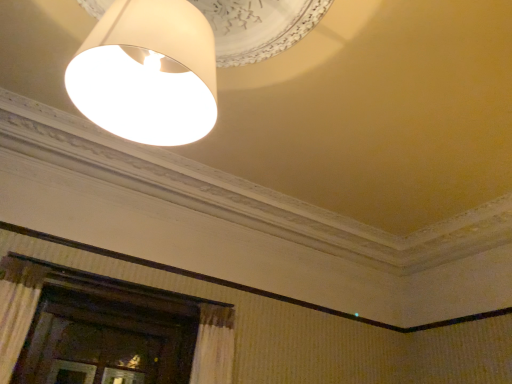
This screenshot has height=384, width=512. Describe the element at coordinates (147, 73) in the screenshot. I see `matte white lampshade at upper center` at that location.

Image resolution: width=512 pixels, height=384 pixels. In order to click on matte white lampshade at upper center in this screenshot , I will do `click(147, 73)`.

In order to face matte white lampshade at upper center, should I rotate leftwards or rightwards?

Turn left by 11.482 degrees to look at matte white lampshade at upper center.

At what (x,y) coordinates should I click in order to perform the action: click on matte white lampshade at upper center. Please return your answer as a coordinate pair (x, y). Looking at the image, I should click on (147, 73).